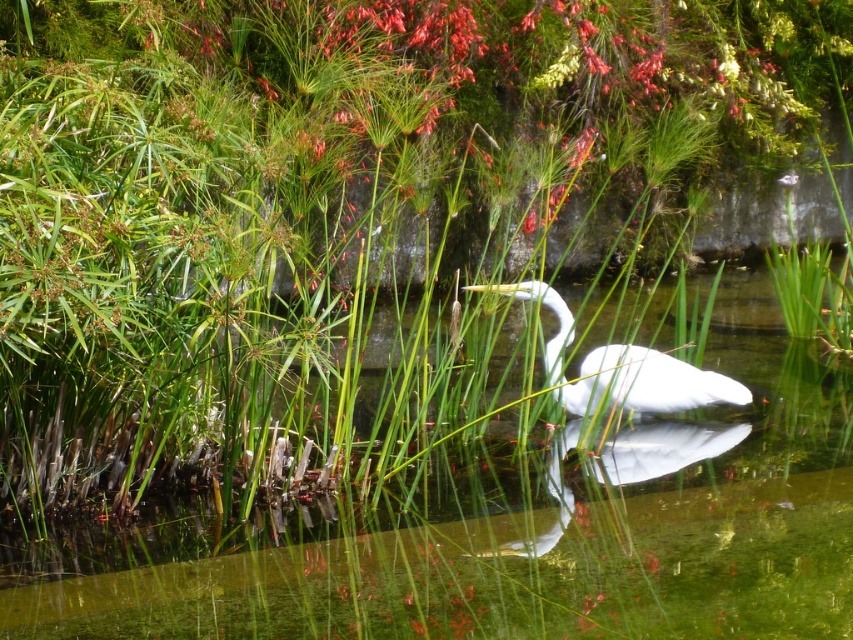
You are a photographer trying to capture the white feathered bird at center. To get a better shot, you want to position yourself so that the clear water at center is between you and the bird. Is this possible based on the scene?

Yes, since the clear water at center is to the left of the white feathered bird at center, positioning yourself to the left side of the water would allow the water to be between you and the bird.

You are a photographer trying to capture the white feathered bird at center and the clear water at center in a single frame. Given that your camera has a minimum focus distance of 20 inches, will you be able to focus on both subjects simultaneously?

The clear water at center and white feathered bird at center are 20.94 inches apart. Since the distance between them is greater than the camera minimum focus distance of 20 inches, you can focus on both subjects simultaneously.

You are a photographer aiming to capture the reflection of the white feathered bird at center in the clear water at center. Based on the scene description, can you confirm if the reflection is visible?

The clear water at center is positioned under the white feathered bird at center, and since reflections are typically visible when the water is calm and the object is above it, the reflection should be visible.